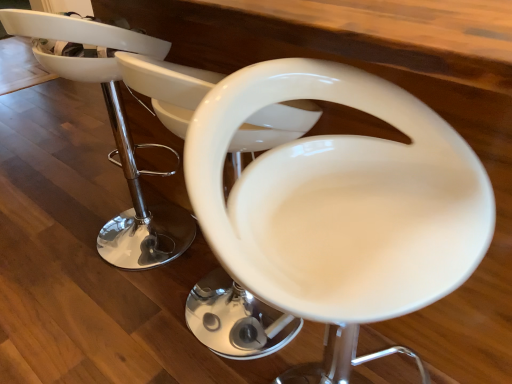
I want to click on free space to the left of white glossy bar stool at center, which is the 2th feeding chair from front to back, so click(112, 322).